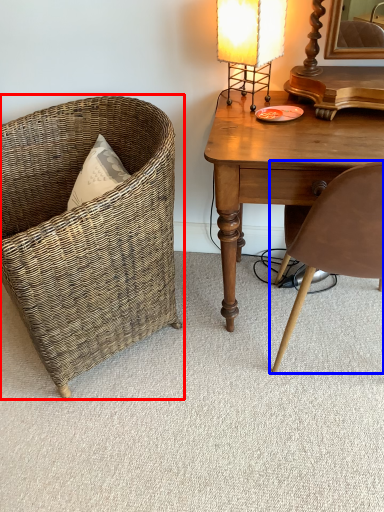
Question: Among these objects, which one is farthest to the camera, chair (highlighted by a red box) or chair (highlighted by a blue box)?

Choices:
 (A) chair
 (B) chair

Answer: (A)